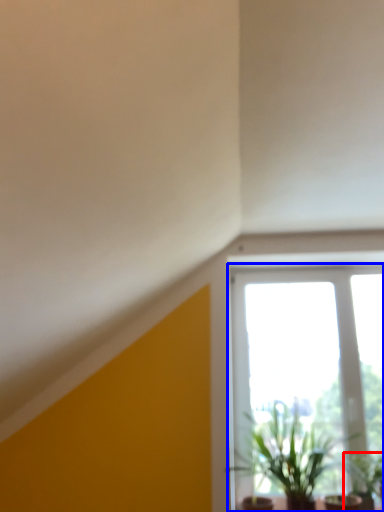
Question: Which object appears farthest to the camera in this image, houseplant (highlighted by a red box) or window (highlighted by a blue box)?

Choices:
 (A) houseplant
 (B) window

Answer: (B)